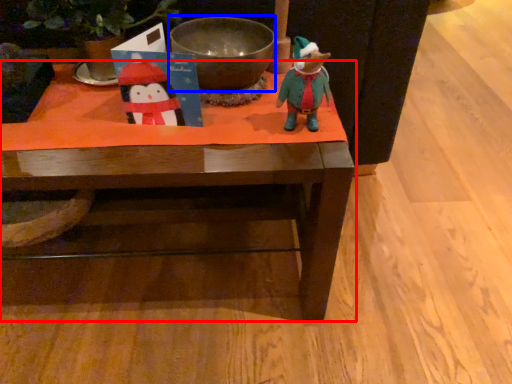
Question: Which object is closer to the camera taking this photo, table (highlighted by a red box) or bowl (highlighted by a blue box)?

Choices:
 (A) table
 (B) bowl

Answer: (A)